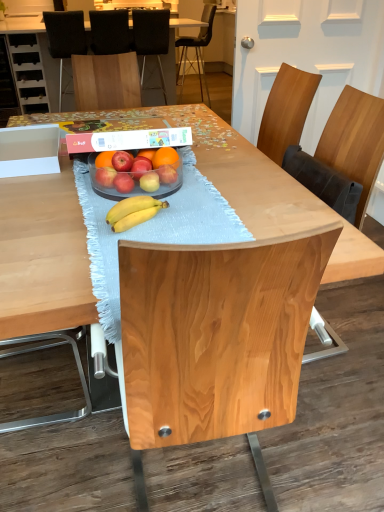
Where is `free spot above light blue textured tablecloth at center (from a real-world perspective)`? free spot above light blue textured tablecloth at center (from a real-world perspective) is located at coordinates click(168, 208).